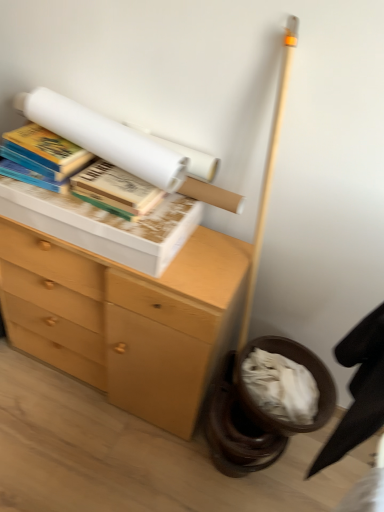
Question: Is white paper at upper center, arranged as the 2th book when viewed from the left, far from hardcover book at upper left, which ranks as the 1th book in left-to-right order?

Choices:
 (A) yes
 (B) no

Answer: (B)

Question: From a real-world perspective, is white paper at upper center, arranged as the second book when viewed from the right, on top of hardcover book at upper left, which ranks as the 1th book in left-to-right order?

Choices:
 (A) no
 (B) yes

Answer: (B)

Question: Considering the relative sizes of white paper at upper center, arranged as the second book when viewed from the right, and hardcover book at upper left, which ranks as the 1th book in left-to-right order, in the image provided, is white paper at upper center, arranged as the second book when viewed from the right, thinner than hardcover book at upper left, which ranks as the 1th book in left-to-right order,?

Choices:
 (A) no
 (B) yes

Answer: (B)

Question: From a real-world perspective, is white paper at upper center, arranged as the 2th book when viewed from the left, physically below hardcover book at upper left, which is counted as the third book, starting from the right?

Choices:
 (A) yes
 (B) no

Answer: (B)

Question: Is the depth of white paper at upper center, arranged as the second book when viewed from the right, greater than that of hardcover book at upper left, which ranks as the 1th book in left-to-right order?

Choices:
 (A) no
 (B) yes

Answer: (A)

Question: Is black fabric swivel chair at lower right in front of or behind white paper at upper center, arranged as the 2th book when viewed from the left, in the image?

Choices:
 (A) behind
 (B) front

Answer: (B)

Question: From the image's perspective, is black fabric swivel chair at lower right located above or below white paper at upper center, arranged as the second book when viewed from the right?

Choices:
 (A) above
 (B) below

Answer: (B)

Question: Is point (365, 382) positioned closer to the camera than point (178, 159)?

Choices:
 (A) farther
 (B) closer

Answer: (B)

Question: From a real-world perspective, is black fabric swivel chair at lower right physically located above or below white paper at upper center, arranged as the 2th book when viewed from the left?

Choices:
 (A) below
 (B) above

Answer: (A)

Question: Considering the positions of point (18, 108) and point (51, 169), is point (18, 108) closer or farther from the camera than point (51, 169)?

Choices:
 (A) farther
 (B) closer

Answer: (A)

Question: In the image, is white paper at upper center, arranged as the 2th book when viewed from the left, positioned in front of or behind hardcover book at upper left, which is counted as the third book, starting from the right?

Choices:
 (A) front
 (B) behind

Answer: (A)

Question: From the image's perspective, relative to hardcover book at upper left, which is counted as the third book, starting from the right, is white paper at upper center, arranged as the second book when viewed from the right, above or below?

Choices:
 (A) above
 (B) below

Answer: (A)

Question: Considering the positions of white paper at upper center, arranged as the second book when viewed from the right, and hardcover book at upper left, which is counted as the third book, starting from the right, in the image, is white paper at upper center, arranged as the second book when viewed from the right, bigger or smaller than hardcover book at upper left, which is counted as the third book, starting from the right,?

Choices:
 (A) small
 (B) big

Answer: (B)

Question: From their relative heights in the image, would you say black fabric swivel chair at lower right is taller or shorter than hardcover book at upper left, which ranks as the 1th book in left-to-right order?

Choices:
 (A) tall
 (B) short

Answer: (A)

Question: Looking at the image, does black fabric swivel chair at lower right seem bigger or smaller compared to hardcover book at upper left, which is counted as the third book, starting from the right?

Choices:
 (A) small
 (B) big

Answer: (B)